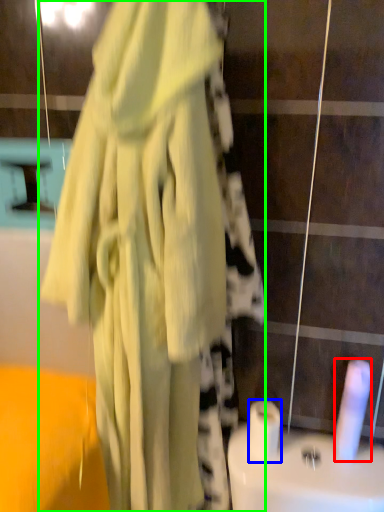
Question: Which object is the closest to the toilet paper (highlighted by a red box)? Choose among these: toilet paper (highlighted by a blue box) or fancy dress (highlighted by a green box).

Choices:
 (A) toilet paper
 (B) fancy dress

Answer: (A)